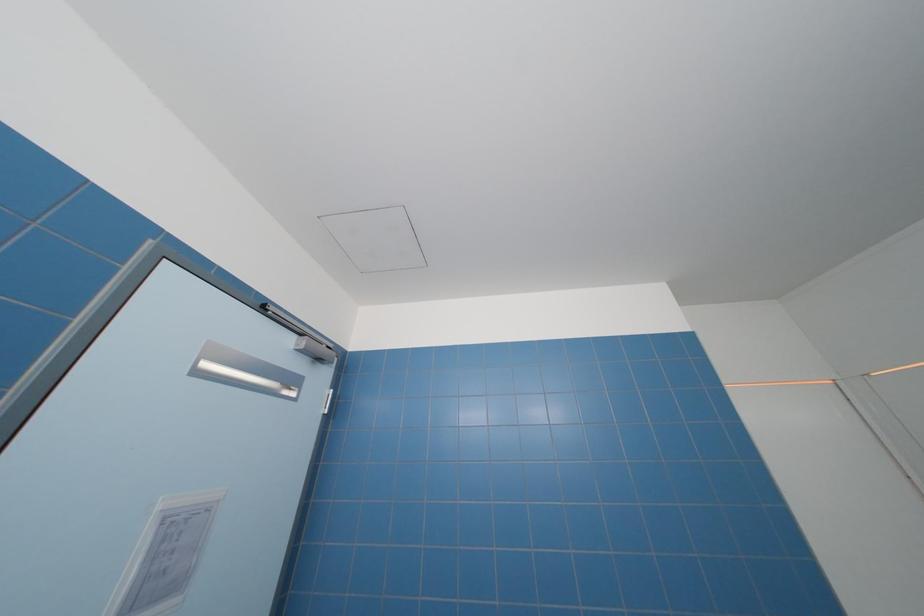
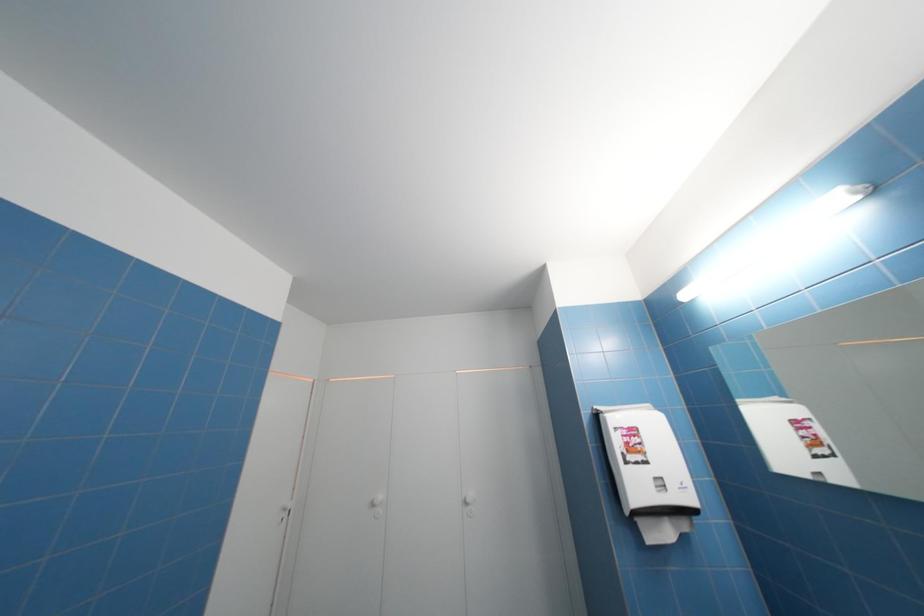
The first image is from the beginning of the video and the second image is from the end. How did the camera likely rotate when shooting the video?

The camera's rotation is toward right-up.